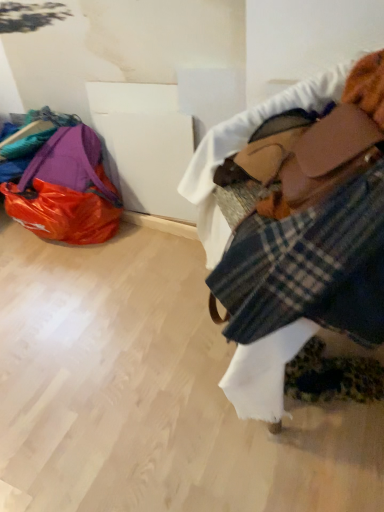
Question: From a real-world perspective, is plaid fabric at right physically below matte purple bag at left?

Choices:
 (A) yes
 (B) no

Answer: (B)

Question: Is there a large distance between plaid fabric at right and matte purple bag at left?

Choices:
 (A) no
 (B) yes

Answer: (B)

Question: Could you tell me if plaid fabric at right is turned towards matte purple bag at left?

Choices:
 (A) no
 (B) yes

Answer: (A)

Question: Does plaid fabric at right have a smaller size compared to matte purple bag at left?

Choices:
 (A) no
 (B) yes

Answer: (B)

Question: Does plaid fabric at right lie behind matte purple bag at left?

Choices:
 (A) yes
 (B) no

Answer: (B)

Question: Does plaid fabric at right have a greater height compared to matte purple bag at left?

Choices:
 (A) no
 (B) yes

Answer: (B)

Question: Could you tell me if matte purple bag at left is turned towards plaid fabric at right?

Choices:
 (A) no
 (B) yes

Answer: (A)

Question: Is matte purple bag at left far away from plaid fabric at right?

Choices:
 (A) no
 (B) yes

Answer: (B)

Question: Considering the relative sizes of matte purple bag at left and plaid fabric at right in the image provided, is matte purple bag at left bigger than plaid fabric at right?

Choices:
 (A) yes
 (B) no

Answer: (A)

Question: From the image's perspective, is matte purple bag at left on plaid fabric at right?

Choices:
 (A) yes
 (B) no

Answer: (A)

Question: Considering the relative sizes of matte purple bag at left and plaid fabric at right in the image provided, is matte purple bag at left taller than plaid fabric at right?

Choices:
 (A) no
 (B) yes

Answer: (A)

Question: Is matte purple bag at left thinner than plaid fabric at right?

Choices:
 (A) yes
 (B) no

Answer: (B)

Question: Can you confirm if plaid fabric at upper right is positioned to the left of plaid fabric at right?

Choices:
 (A) yes
 (B) no

Answer: (B)